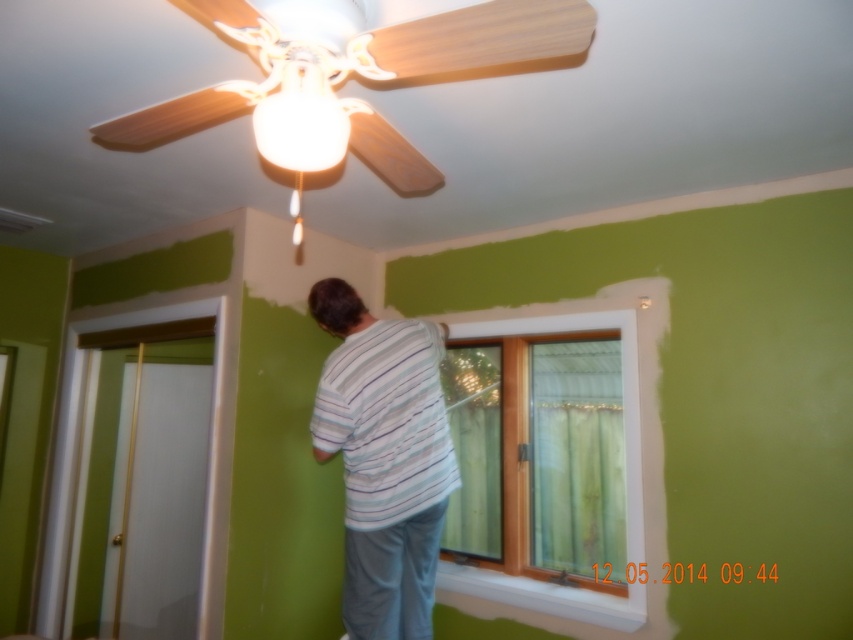
Is wooden ceiling fan at upper center above white wooden window at center?

Yes.

Is wooden ceiling fan at upper center thinner than white wooden window at center?

In fact, wooden ceiling fan at upper center might be wider than white wooden window at center.

Is point (410, 173) less distant than point (616, 602)?

Yes, point (410, 173) is in front of point (616, 602).

I want to click on wooden ceiling fan at upper center, so click(483, 42).

Does point (585, 52) come closer to viewer compared to point (582, 404)?

Yes, point (585, 52) is in front of point (582, 404).

Can you confirm if wooden ceiling fan at upper center is bigger than green sheer curtain at window?

Yes, wooden ceiling fan at upper center is bigger than green sheer curtain at window.

Is point (374, 45) farther from viewer compared to point (579, 378)?

No, (374, 45) is in front of (579, 378).

Locate an element on the screen. This screenshot has width=853, height=640. wooden ceiling fan at upper center is located at coordinates (483, 42).

What do you see at coordinates (384, 458) in the screenshot? The image size is (853, 640). I see `striped cotton shirt at center` at bounding box center [384, 458].

Between striped cotton shirt at center and green sheer curtain at window, which one is positioned lower?

Positioned lower is green sheer curtain at window.

Image resolution: width=853 pixels, height=640 pixels. Describe the element at coordinates (384, 458) in the screenshot. I see `striped cotton shirt at center` at that location.

Where is `striped cotton shirt at center`? Image resolution: width=853 pixels, height=640 pixels. striped cotton shirt at center is located at coordinates (384, 458).